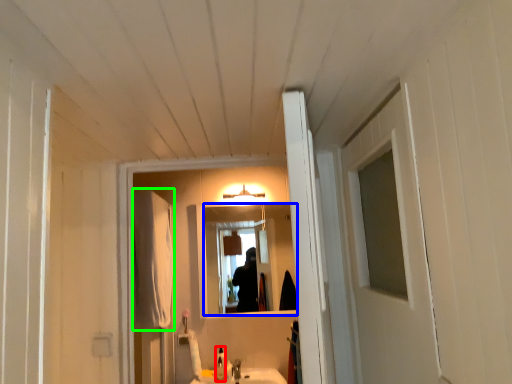
Question: Which object is positioned farthest from bottle (highlighted by a red box)? Select from mirror (highlighted by a blue box) and curtain (highlighted by a green box).

Choices:
 (A) mirror
 (B) curtain

Answer: (A)